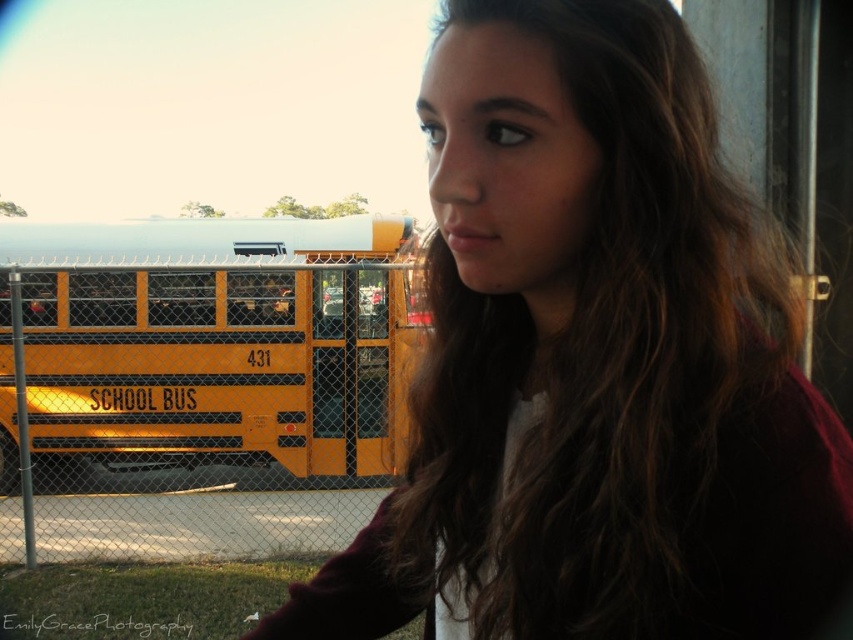
In the scene shown: Does matte yellow school bus at left come in front of yellow matte school bus at left?

Yes.

Who is higher up, matte yellow school bus at left or yellow matte school bus at left?

Positioned higher is matte yellow school bus at left.

Which is in front, point (442, 285) or point (323, 403)?

Point (442, 285) is more forward.

You are a GUI agent. You are given a task and a screenshot of the screen. Output one action in this format:
    pyautogui.click(x=<x>, y=<y>)
    Task: Click on the matte yellow school bus at left
    The width and height of the screenshot is (853, 640).
    Given the screenshot: What is the action you would take?
    pyautogui.click(x=593, y=362)